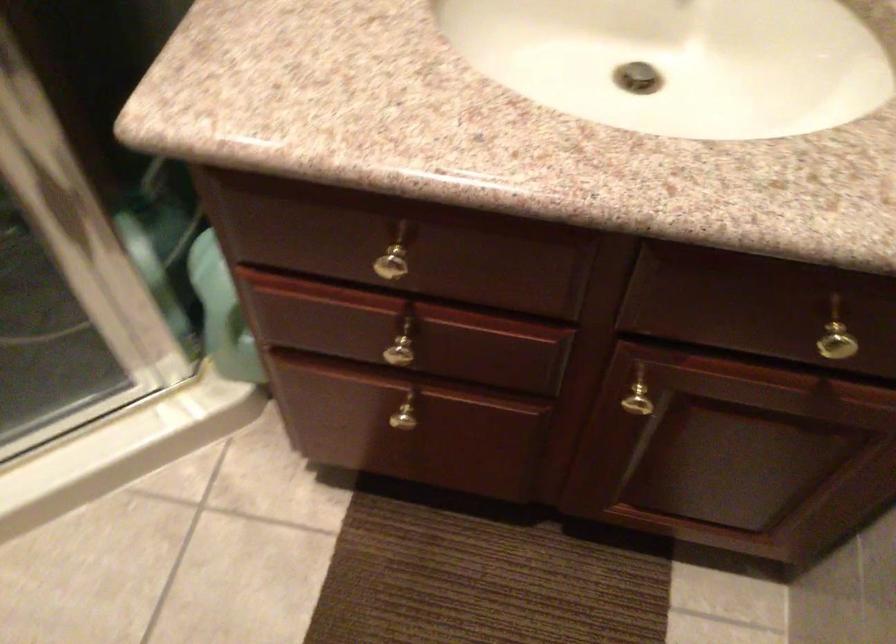
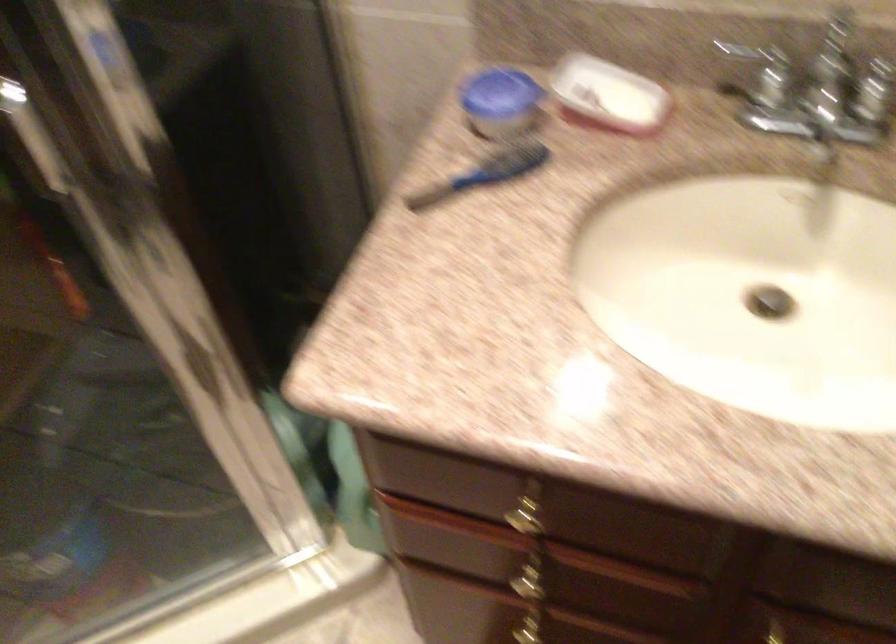
Question: The camera is either moving clockwise (left) or counter-clockwise (right) around the object. The first image is from the beginning of the video and the second image is from the end. Is the camera moving left or right when shooting the video?

Choices:
 (A) Left
 (B) Right

Answer: (B)